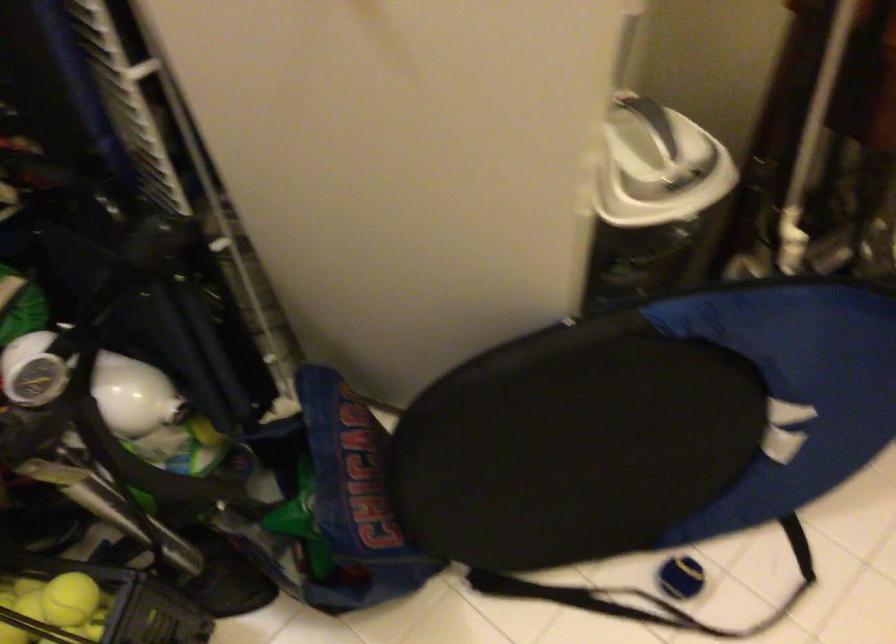
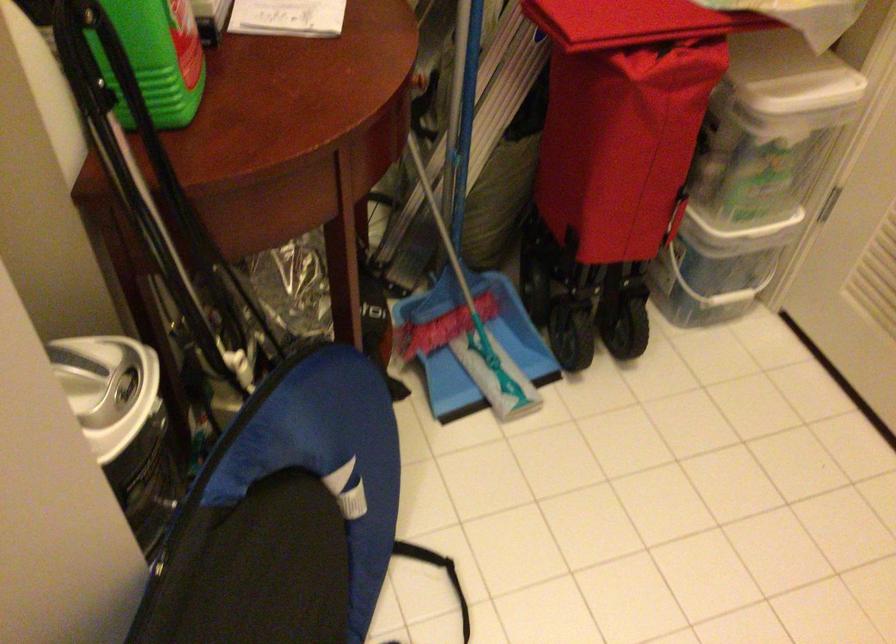
Where in the second image is the point corresponding to (x=651, y=412) from the first image?

(271, 569)